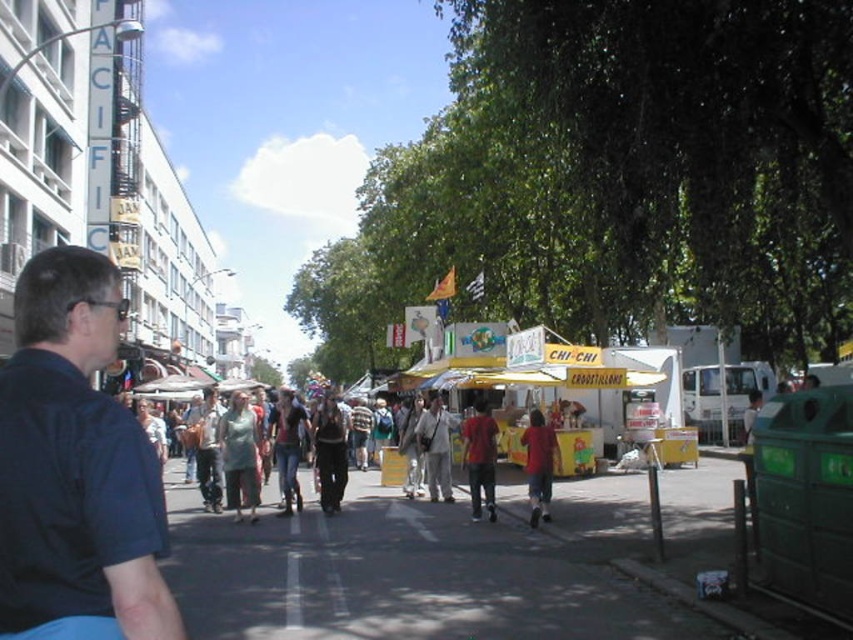
Question: In this image, where is dark blue shirt at left located relative to matte red shirt at center?

Choices:
 (A) right
 (B) left

Answer: (B)

Question: Which point is closer to the camera?

Choices:
 (A) (366, 513)
 (B) (531, 426)
 (C) (486, 480)
 (D) (161, 532)

Answer: (D)

Question: Does dark gray asphalt at center have a lesser width compared to dark blue shirt at left?

Choices:
 (A) yes
 (B) no

Answer: (B)

Question: Does dark gray asphalt at center have a greater width compared to matte red shirt at center?

Choices:
 (A) yes
 (B) no

Answer: (A)

Question: Which point is farther to the camera?

Choices:
 (A) (474, 579)
 (B) (546, 492)
 (C) (38, 330)

Answer: (B)

Question: Which object is the closest to the dark gray asphalt at center?

Choices:
 (A) matte red shirt at center
 (B) red matte shirt at center

Answer: (A)